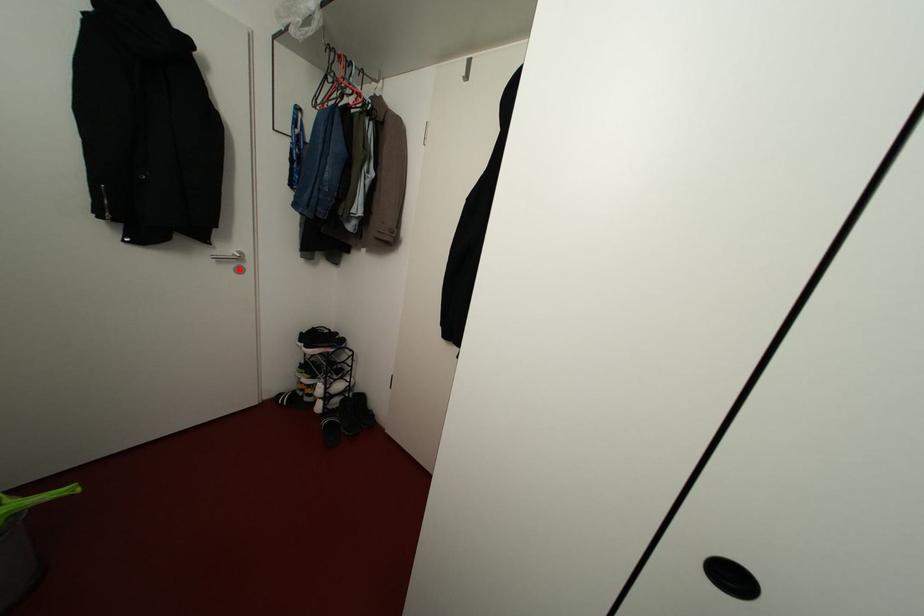
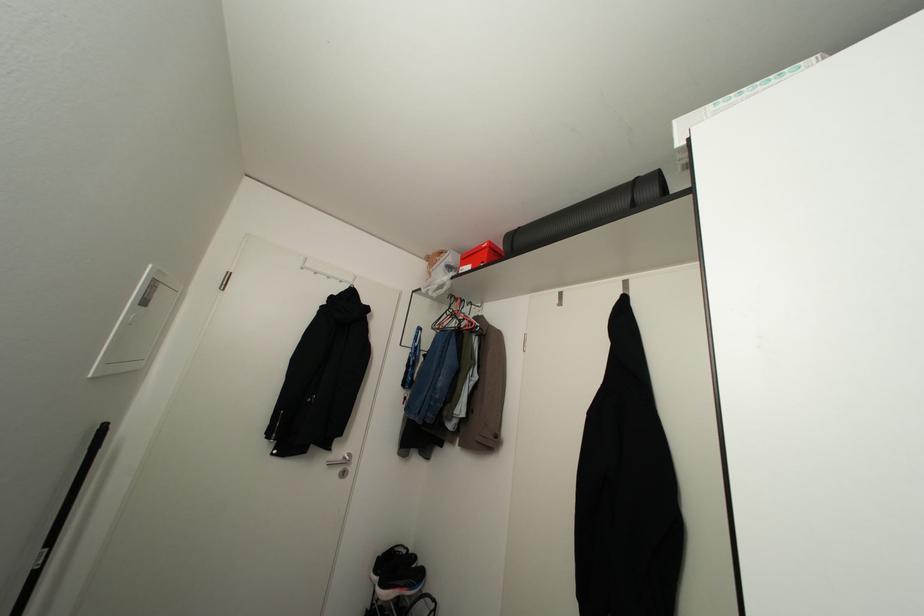
Locate, in the second image, the point that corresponds to the highlighted location in the first image.

(343, 472)